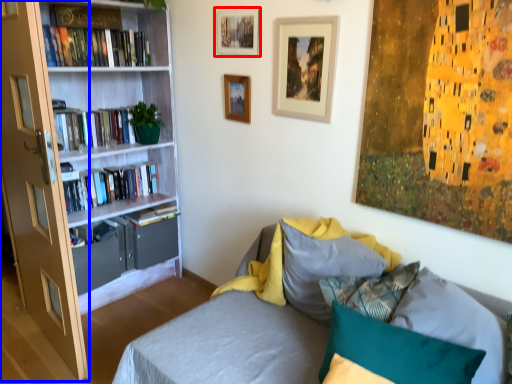
Question: Among these objects, which one is farthest to the camera, picture frame (highlighted by a red box) or glass door (highlighted by a blue box)?

Choices:
 (A) picture frame
 (B) glass door

Answer: (A)